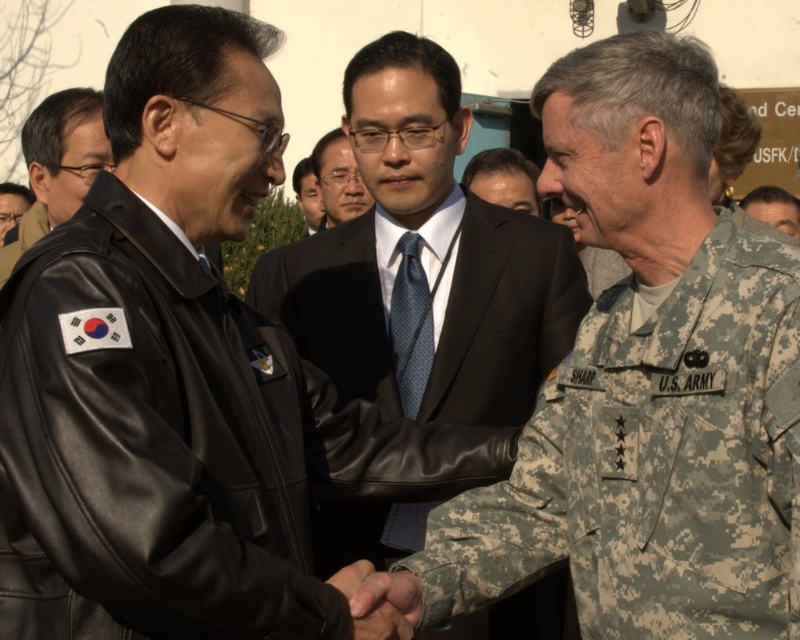
You are organizing a photo shoot and need to ensure that all clothing items are displayed properly. Given the scene described, which clothing item, the leather jacket at left or the matte black suit at center, requires a larger mannequin based on their size?

The leather jacket at left requires a larger mannequin because it is bigger than the matte black suit at center.

You are an observer at the formal event. You notice two hands at the center of the image, one belonging to the camouflage fabric hand at center and the other to the dark suit at center. Which hand is larger?

The dark suit at center is larger than the camouflage fabric hand at center.

You are a photographer who wants to focus on the blue dotted fabric tie at center in the image. What are the coordinates of the tie?

The coordinates of the blue dotted fabric tie at center are at point (410, 324).